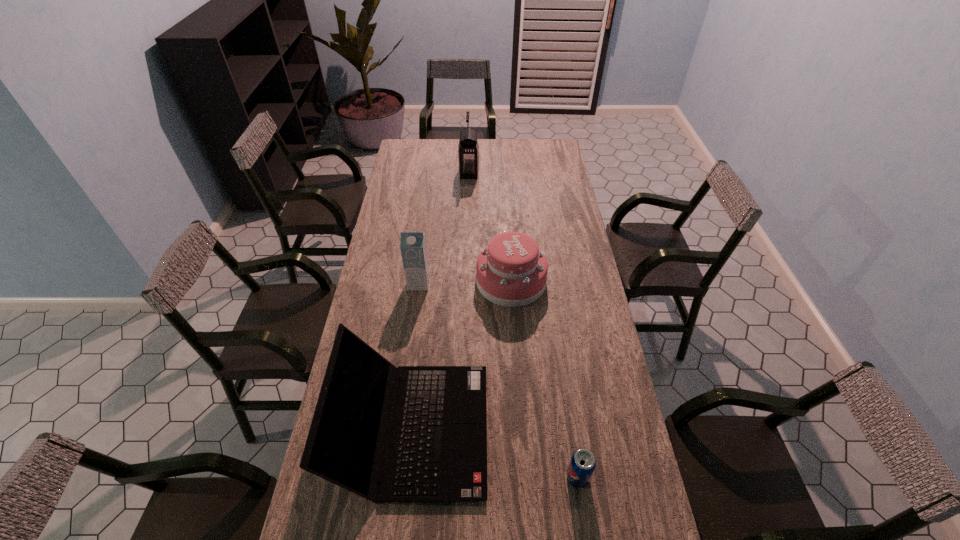
Locate an element on the screen. This screenshot has height=540, width=960. free space located 0.130m on the right of the shortest object is located at coordinates (636, 477).

Find the location of a particular element. Image resolution: width=960 pixels, height=540 pixels. carton that is at the left edge is located at coordinates (413, 248).

I want to click on laptop computer situated at the left edge, so click(438, 453).

The image size is (960, 540). Find the location of `object that is at the right edge`. object that is at the right edge is located at coordinates (582, 464).

This screenshot has width=960, height=540. In the image, there is a desktop. Find the location of `vacant space at the left edge`. vacant space at the left edge is located at coordinates (394, 196).

Find the location of `free spot at the right edge of the desktop`. free spot at the right edge of the desktop is located at coordinates (633, 516).

In the image, there is a desktop. What are the coordinates of `free space at the far left corner` in the screenshot? It's located at (428, 140).

The width and height of the screenshot is (960, 540). Find the location of `vacant space at the far right corner of the desktop`. vacant space at the far right corner of the desktop is located at coordinates coord(563,160).

I want to click on free spot between the carton and the shortest object, so click(x=498, y=380).

At what (x,y) coordinates should I click in order to perform the action: click on free space between the farthest object and the carton. Please return your answer as a coordinate pair (x, y). The image size is (960, 540). Looking at the image, I should click on (444, 228).